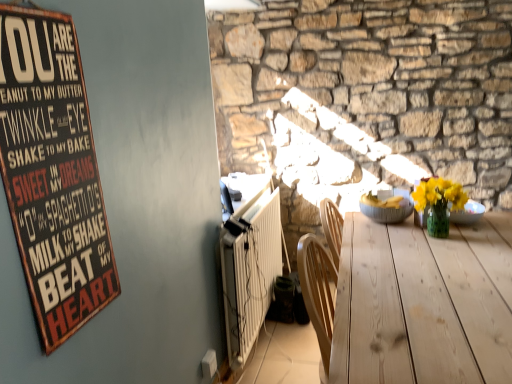
Question: Is light wood table at center thinner than white ribbed radiator at lower left?

Choices:
 (A) no
 (B) yes

Answer: (A)

Question: Are light wood table at center and white ribbed radiator at lower left far apart?

Choices:
 (A) no
 (B) yes

Answer: (A)

Question: Is light wood table at center looking in the opposite direction of white ribbed radiator at lower left?

Choices:
 (A) yes
 (B) no

Answer: (B)

Question: Considering the relative sizes of light wood table at center and white ribbed radiator at lower left in the image provided, is light wood table at center bigger than white ribbed radiator at lower left?

Choices:
 (A) no
 (B) yes

Answer: (B)

Question: Is light wood table at center touching white ribbed radiator at lower left?

Choices:
 (A) no
 (B) yes

Answer: (A)

Question: From a real-world perspective, does light wood table at center sit lower than white ribbed radiator at lower left?

Choices:
 (A) yes
 (B) no

Answer: (B)

Question: Does gray textured bowl at center contain light wood table at center?

Choices:
 (A) no
 (B) yes

Answer: (A)

Question: From the image's perspective, is gray textured bowl at center located above light wood table at center?

Choices:
 (A) no
 (B) yes

Answer: (B)

Question: Can you confirm if gray textured bowl at center is positioned to the left of light wood table at center?

Choices:
 (A) no
 (B) yes

Answer: (A)

Question: From the image's perspective, is gray textured bowl at center located beneath light wood table at center?

Choices:
 (A) yes
 (B) no

Answer: (B)

Question: Is gray textured bowl at center not close to light wood table at center?

Choices:
 (A) no
 (B) yes

Answer: (A)

Question: From a real-world perspective, is gray textured bowl at center on light wood table at center?

Choices:
 (A) yes
 (B) no

Answer: (A)

Question: Considering the relative sizes of white ribbed radiator at lower left and wooden signboard at left in the image provided, is white ribbed radiator at lower left shorter than wooden signboard at left?

Choices:
 (A) yes
 (B) no

Answer: (A)